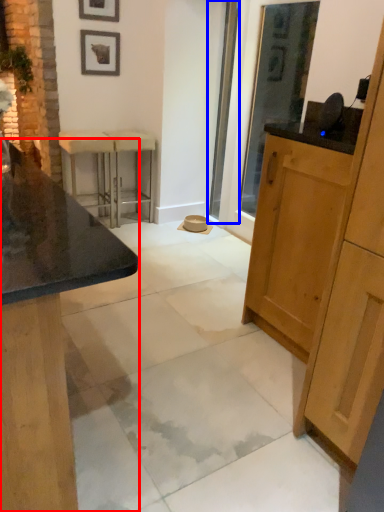
Question: Which of the following is the farthest to the observer, cabinetry (highlighted by a red box) or screen door (highlighted by a blue box)?

Choices:
 (A) cabinetry
 (B) screen door

Answer: (B)